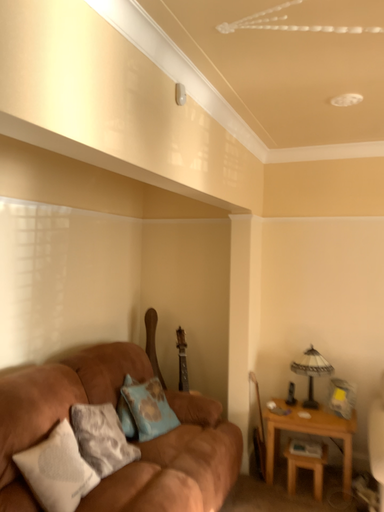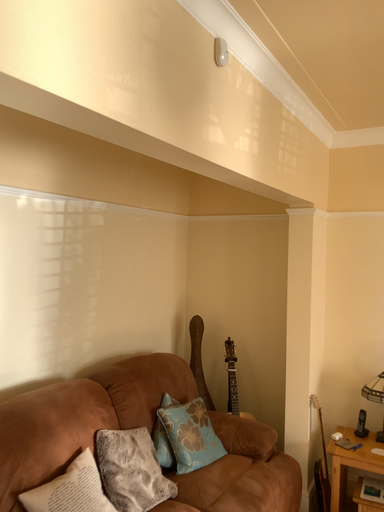
Question: Which way did the camera rotate in the video?

Choices:
 (A) rotated right
 (B) rotated left

Answer: (B)